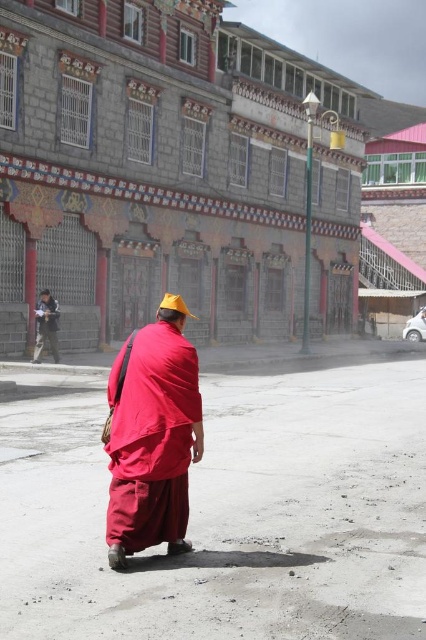
Question: Is gray stone building at center behind matte black monk at left?

Choices:
 (A) yes
 (B) no

Answer: (B)

Question: Is gray stone building at center to the left of red cotton robe at center from the viewer's perspective?

Choices:
 (A) yes
 (B) no

Answer: (B)

Question: Which object is closer to the camera taking this photo?

Choices:
 (A) gray stone building at center
 (B) matte black monk at left
 (C) red cotton robe at center

Answer: (C)

Question: Estimate the real-world distances between objects in this image. Which object is farther from the yellow fabric hat at center?

Choices:
 (A) gray stone building at center
 (B) matte black monk at left
 (C) red cotton robe at center

Answer: (A)

Question: Does gray stone building at center appear on the left side of yellow fabric hat at center?

Choices:
 (A) no
 (B) yes

Answer: (A)

Question: Among these points, which one is farthest from the camera?

Choices:
 (A) (143, 22)
 (B) (52, 356)

Answer: (A)